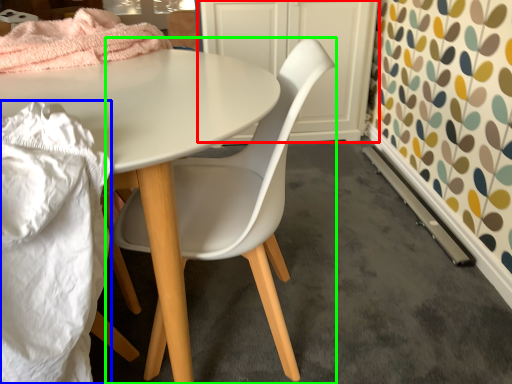
Question: Which is farther away from cabinetry (highlighted by a red box)? material (highlighted by a blue box) or chair (highlighted by a green box)?

Choices:
 (A) material
 (B) chair

Answer: (A)